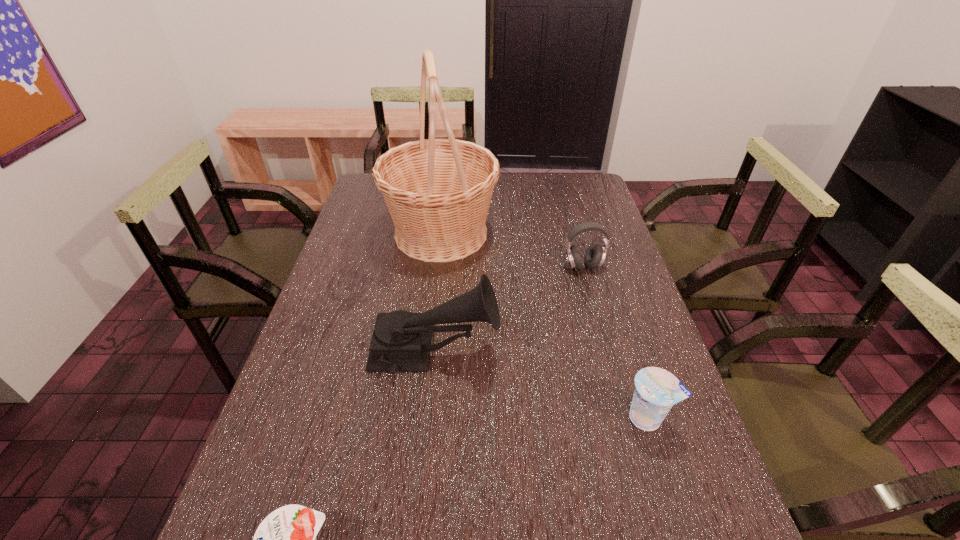
Identify the location of free space between the right yogurt and the basket. (x=544, y=326).

Locate an element on the screen. vacant region between the fourth shortest object and the farther yogurt is located at coordinates (541, 384).

This screenshot has height=540, width=960. I want to click on vacant area that lies between the third nearest object and the headset, so click(x=509, y=309).

Find the location of a particular element. vacant space in between the headset and the tallest object is located at coordinates (512, 250).

Locate which object ranks third in proximity to the fourth farthest object. Please provide its 2D coordinates. Your answer should be formatted as a tuple, i.e. [(x, y)], where the tuple contains the x and y coordinates of a point satisfying the conditions above.

[(438, 191)]

Locate an element on the screen. This screenshot has height=540, width=960. object that is the fourth closest to the second nearest object is located at coordinates (286, 539).

Image resolution: width=960 pixels, height=540 pixels. What are the coordinates of `blank area in the image that satisfies the following two spatial constraints: 1. on the ear cups of the fourth farthest object; 2. on the right side of the third tallest object` in the screenshot? It's located at (624, 418).

The height and width of the screenshot is (540, 960). I want to click on free space in the image that satisfies the following two spatial constraints: 1. from the horn of the phonograph_record; 2. on the back side of the farther yogurt, so click(428, 418).

This screenshot has width=960, height=540. What are the coordinates of `free space that satisfies the following two spatial constraints: 1. on the ear cups of the headset; 2. on the right side of the farther yogurt` in the screenshot? It's located at (624, 418).

Where is `vacant area in the image that satisfies the following two spatial constraints: 1. on the ear cups of the third shortest object; 2. from the horn of the phonograph_record`? vacant area in the image that satisfies the following two spatial constraints: 1. on the ear cups of the third shortest object; 2. from the horn of the phonograph_record is located at coordinates (606, 352).